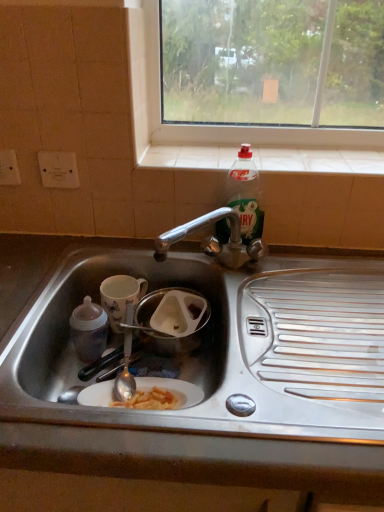
Question: From a real-world perspective, is porcelain floral mug at sink, which ranks as the first coffee cup in back-to-front order, on top of matte ceramic coffee cup at left, which is counted as the second coffee cup, starting from the back?

Choices:
 (A) no
 (B) yes

Answer: (A)

Question: From the image's perspective, would you say porcelain floral mug at sink, which ranks as the first coffee cup in back-to-front order, is positioned over matte ceramic coffee cup at left, which is counted as the second coffee cup, starting from the back?

Choices:
 (A) no
 (B) yes

Answer: (B)

Question: Can you confirm if porcelain floral mug at sink, which ranks as the first coffee cup in back-to-front order, is shorter than matte ceramic coffee cup at left, which is the 1th coffee cup from front to back?

Choices:
 (A) no
 (B) yes

Answer: (B)

Question: Is porcelain floral mug at sink, which ranks as the first coffee cup in back-to-front order, positioned before matte ceramic coffee cup at left, which is counted as the second coffee cup, starting from the back?

Choices:
 (A) yes
 (B) no

Answer: (B)

Question: Is porcelain floral mug at sink, the 2th coffee cup when ordered from front to back, far from matte ceramic coffee cup at left, which is the 1th coffee cup from front to back?

Choices:
 (A) yes
 (B) no

Answer: (B)

Question: In the image, is translucent plastic bottle at upper right on the left side or the right side of matte ceramic coffee cup at left, which is the 1th coffee cup from front to back?

Choices:
 (A) left
 (B) right

Answer: (B)

Question: Considering the positions of translucent plastic bottle at upper right and matte ceramic coffee cup at left, which is the 1th coffee cup from front to back, in the image, is translucent plastic bottle at upper right wider or thinner than matte ceramic coffee cup at left, which is the 1th coffee cup from front to back,?

Choices:
 (A) thin
 (B) wide

Answer: (A)

Question: Is point (256, 208) closer or farther from the camera than point (69, 328)?

Choices:
 (A) closer
 (B) farther

Answer: (B)

Question: From the image's perspective, is translucent plastic bottle at upper right located above or below matte ceramic coffee cup at left, which is counted as the second coffee cup, starting from the back?

Choices:
 (A) below
 (B) above

Answer: (B)

Question: From a real-world perspective, is matte ceramic coffee cup at left, which is counted as the second coffee cup, starting from the back, physically located above or below porcelain floral mug at sink, which ranks as the first coffee cup in back-to-front order?

Choices:
 (A) below
 (B) above

Answer: (B)

Question: Does point (82, 337) appear closer or farther from the camera than point (130, 291)?

Choices:
 (A) farther
 (B) closer

Answer: (B)

Question: Is matte ceramic coffee cup at left, which is counted as the second coffee cup, starting from the back, taller or shorter than porcelain floral mug at sink, which ranks as the first coffee cup in back-to-front order?

Choices:
 (A) short
 (B) tall

Answer: (B)

Question: Considering the positions of matte ceramic coffee cup at left, which is the 1th coffee cup from front to back, and porcelain floral mug at sink, the 2th coffee cup when ordered from front to back, in the image, is matte ceramic coffee cup at left, which is the 1th coffee cup from front to back, wider or thinner than porcelain floral mug at sink, the 2th coffee cup when ordered from front to back,?

Choices:
 (A) thin
 (B) wide

Answer: (A)

Question: Is white tile at upper center to the left or to the right of translucent plastic bottle at upper right in the image?

Choices:
 (A) left
 (B) right

Answer: (B)

Question: Looking at their shapes, would you say white tile at upper center is wider or thinner than translucent plastic bottle at upper right?

Choices:
 (A) wide
 (B) thin

Answer: (A)